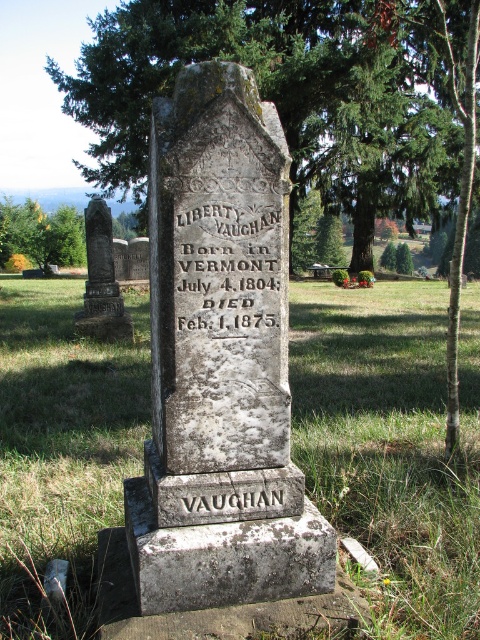
You are a gardener tasked with trimming plants around the green leafy tree at center and the rusty metal gravestone at left. Which object requires more attention to avoid blocking the path between them?

The green leafy tree at center requires more attention because its width surpasses that of the rusty metal gravestone at left, meaning it is more likely to block the path between them.

You are a gardener tasked with trimming the green leafy tree at center and the rusty metal gravestone at left. Which object requires more attention to avoid damaging the other? Please explain based on their sizes.

The green leafy tree at center is larger in size than the rusty metal gravestone at left. Therefore, when trimming the tree, more attention is needed to ensure branches do not overhang and damage the gravestone.

You are standing in a cemetery and see the gray stone gravestone at center and the rusty metal gravestone at left. Which one is positioned lower in the image?

The gray stone gravestone at center is positioned lower than the rusty metal gravestone at left.